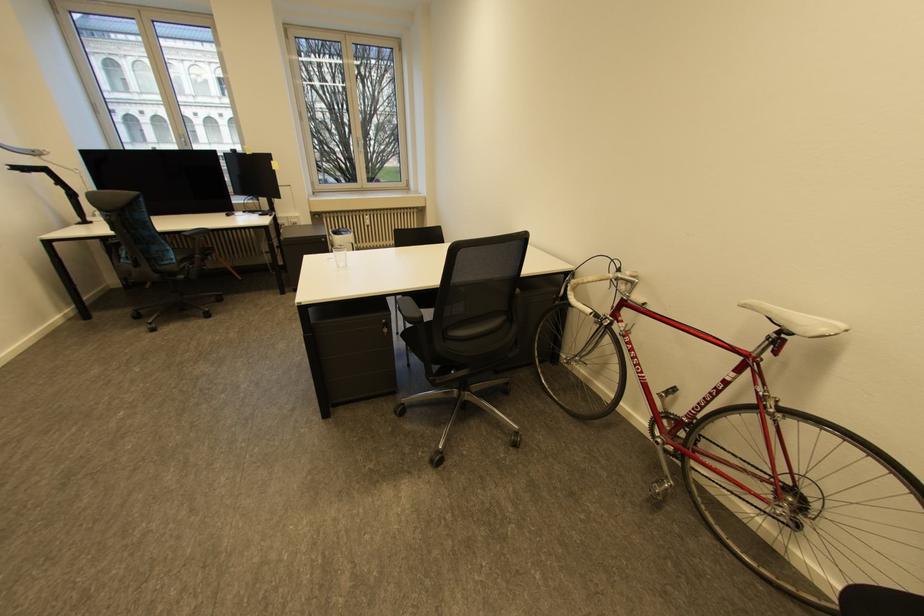
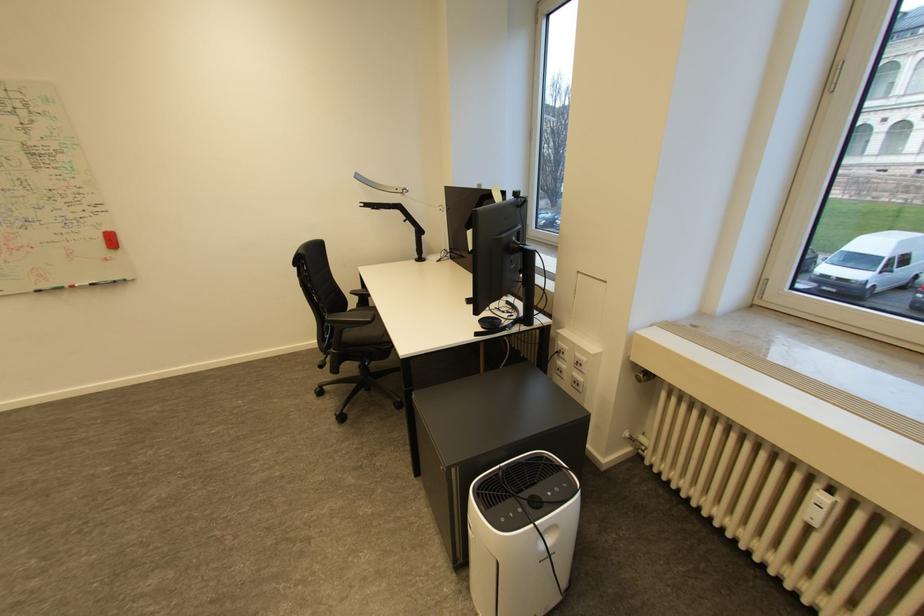
The point at [374,227] is marked in the first image. Where is the corresponding point in the second image?

(816, 525)